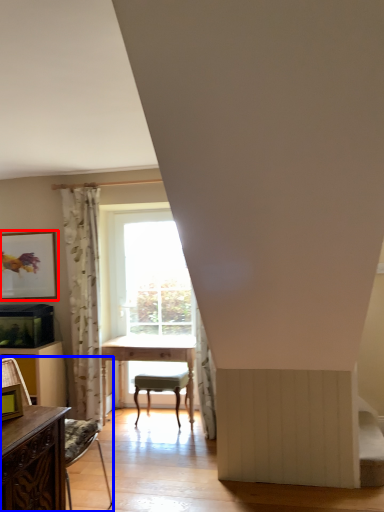
Question: Which point is further to the camera, picture frame (highlighted by a red box) or chair (highlighted by a blue box)?

Choices:
 (A) picture frame
 (B) chair

Answer: (A)